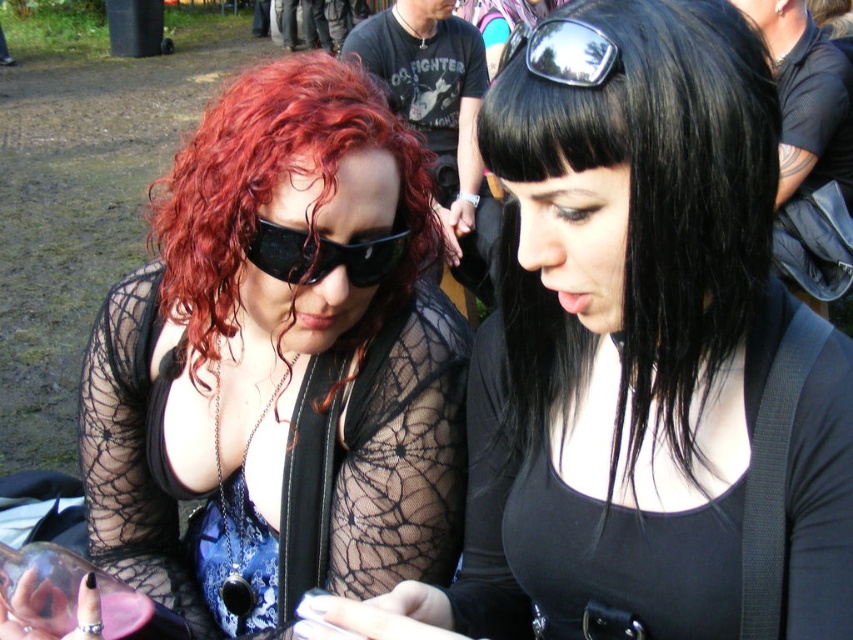
You are a photographer trying to capture a candid shot of the two people in the scene. You want to ensure that both the matte black hair at center and the metallic reflective sunglasses at upper center are clearly visible in the photo. Given their sizes, which object should you focus on first to ensure it is in sharp focus?

The matte black hair at center is much taller as metallic reflective sunglasses at upper center, so you should focus on the metallic reflective sunglasses at upper center first since it is smaller and requires precise focus to capture details.

You are a photographer trying to capture a closeup shot of the sunglasses. Given that your camera can only focus on objects within a 10cm height range, and the distance between the black matte sunglasses at center and metallic reflective sunglasses at upper center is exactly 10cm, which pair should you focus on to ensure both are in focus?

The black matte sunglasses at center has a lesser height compared to metallic reflective sunglasses at upper center. Since the distance between them is exactly 10cm and the camera can focus within a 10cm height range, focusing on the black matte sunglasses at center would ensure both pairs are within the focus range as the height difference is accommodated within the 10cm limit.